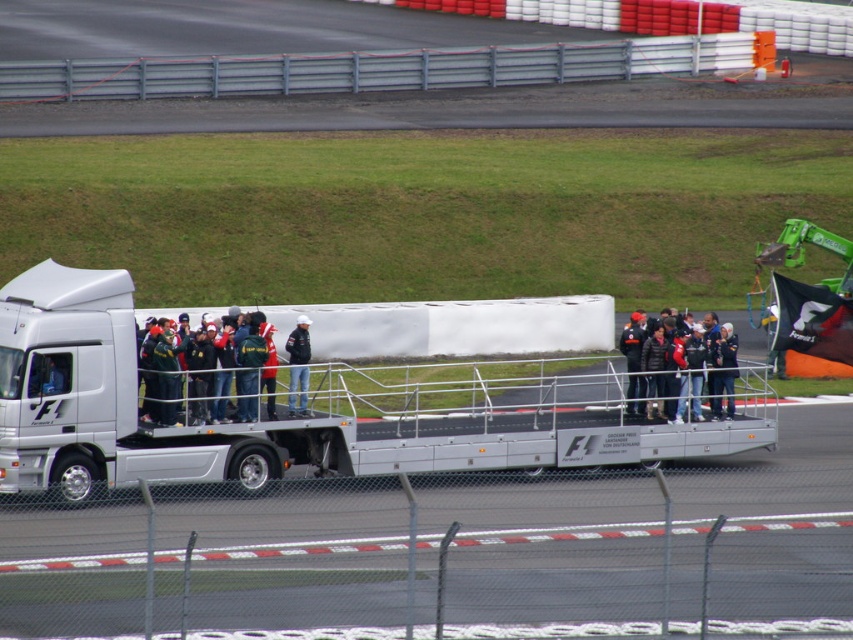
Question: Which point is farther to the camera?

Choices:
 (A) dark gray jacket at center
 (B) dark green fabric jacket at center

Answer: (A)

Question: Based on their relative distances, which object is farther from the denim jeans at center?

Choices:
 (A) dark green fabric jacket at center
 (B) silver metallic flatbed truck at center

Answer: (B)

Question: Is silver metallic flatbed truck at center thinner than dark gray jacket at center?

Choices:
 (A) no
 (B) yes

Answer: (A)

Question: Which point is farther from the camera taking this photo?

Choices:
 (A) (268, 355)
 (B) (299, 401)
 (C) (619, 342)
 (D) (248, 452)

Answer: (C)

Question: Is silver metallic flatbed truck at center to the left of dark gray jacket at center from the viewer's perspective?

Choices:
 (A) no
 (B) yes

Answer: (B)

Question: In this image, where is dark green fabric jacket at center located relative to dark gray jacket at center?

Choices:
 (A) left
 (B) right

Answer: (A)